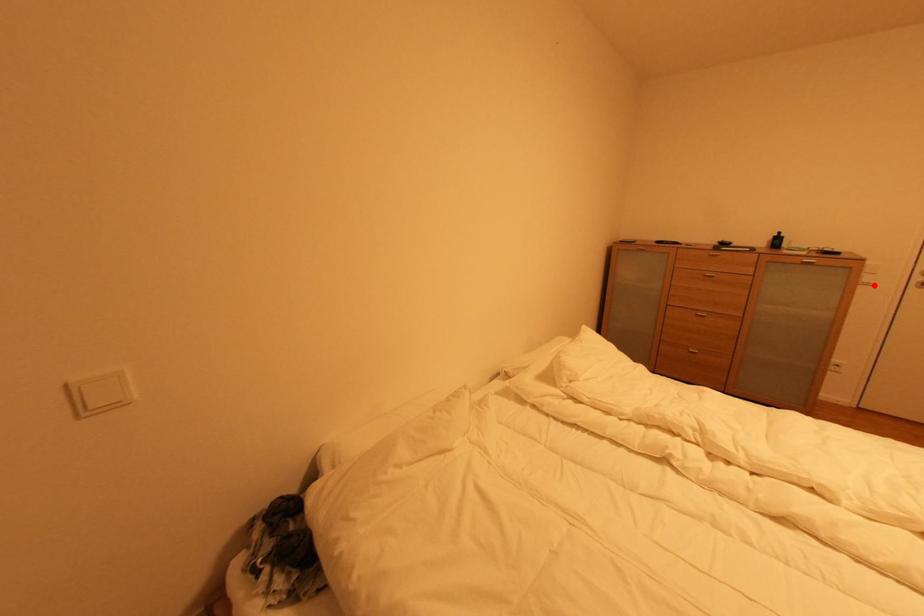
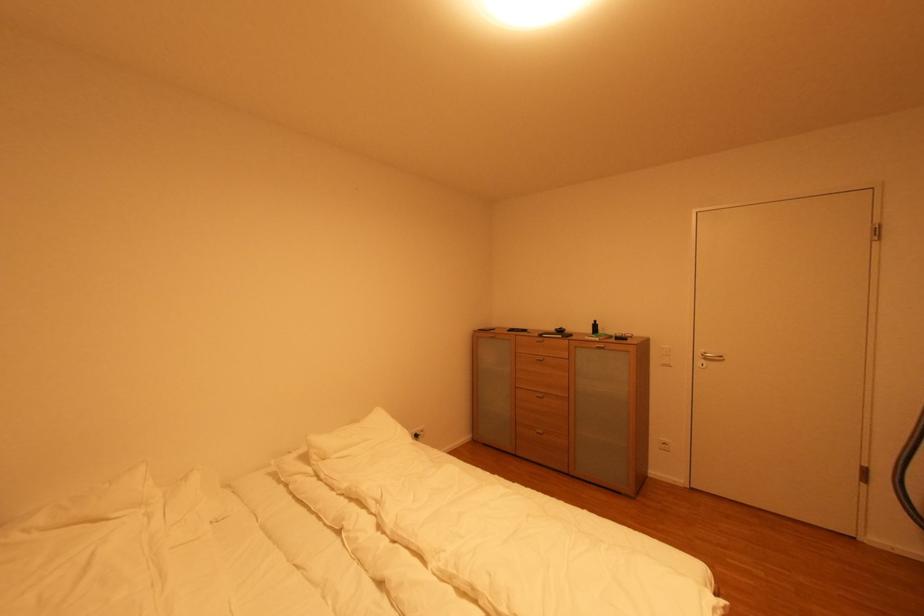
Locate, in the second image, the point that corresponds to the highlighted location in the first image.

(670, 367)